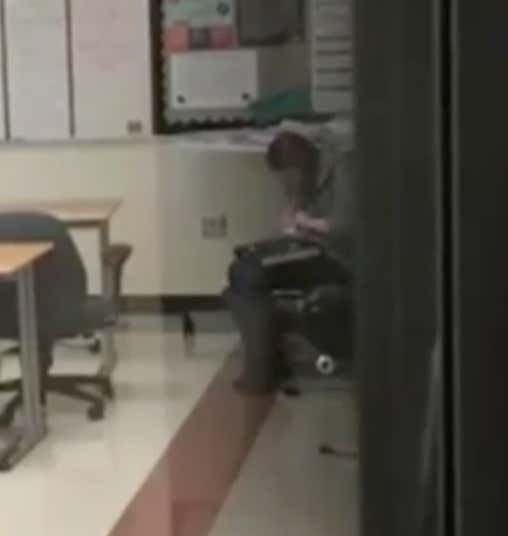
Identify the location of black wall trim. (176, 304).